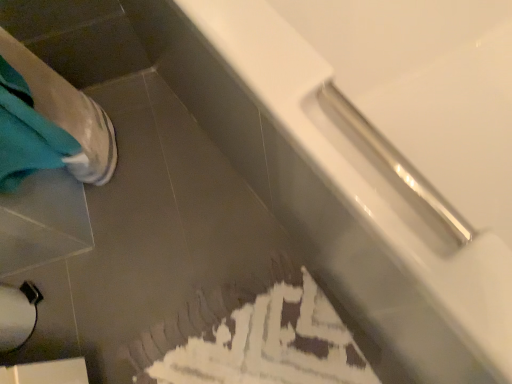
Question: Looking at the image, does white matte toilet paper at lower left seem bigger or smaller compared to white glossy bathtub at upper right?

Choices:
 (A) small
 (B) big

Answer: (A)

Question: From the image's perspective, is white matte toilet paper at lower left above or below white glossy bathtub at upper right?

Choices:
 (A) below
 (B) above

Answer: (A)

Question: Would you say white matte toilet paper at lower left is to the left or to the right of white glossy bathtub at upper right in the picture?

Choices:
 (A) left
 (B) right

Answer: (A)

Question: Is white glossy bathtub at upper right spatially inside white matte toilet paper at lower left, or outside of it?

Choices:
 (A) outside
 (B) inside

Answer: (A)

Question: In the image, is white glossy bathtub at upper right on the left side or the right side of white matte toilet paper at lower left?

Choices:
 (A) left
 (B) right

Answer: (B)

Question: From a real-world perspective, relative to white matte toilet paper at lower left, is white glossy bathtub at upper right vertically above or below?

Choices:
 (A) above
 (B) below

Answer: (A)

Question: Looking at their shapes, would you say white glossy bathtub at upper right is wider or thinner than white matte toilet paper at lower left?

Choices:
 (A) thin
 (B) wide

Answer: (B)